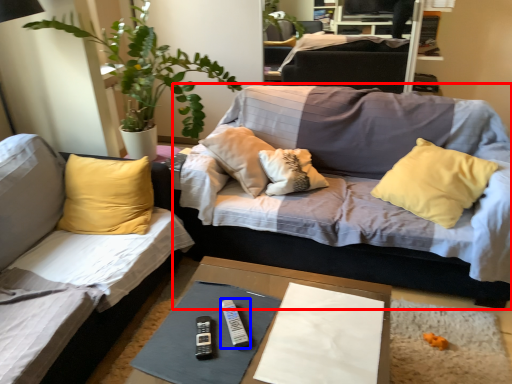
Question: Which point is closer to the camera, studio couch (highlighted by a red box) or remote (highlighted by a blue box)?

Choices:
 (A) studio couch
 (B) remote

Answer: (B)